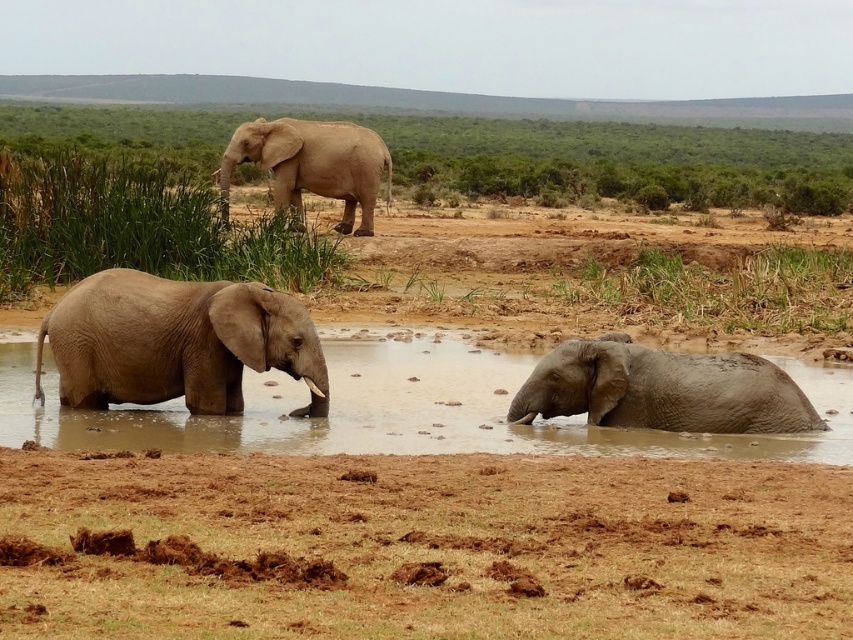
You are standing at the point marked by the coordinates [663,390] in the image. Looking around, you see a gray matte elephant at lower right. Which direction should you face to see the gray matte elephant at lower right?

The point marked by the coordinates [663,390] is the location of the gray matte elephant at lower right, so you are already facing it.

You are a wildlife photographer standing at the edge of the watering hole. You want to capture a close shot of the brown muddy water at center. If your camera has a maximum zoom range of 10 meters, can you get a clear close shot without moving closer?

The brown muddy water at center is 9.50 meters away from the viewer. Since the camera can zoom up to 10 meters, it is within range to capture a clear close shot without moving closer.

You are standing in the scene and want to place a small camera at one of the two points to capture the elephants in the water. Which point, point (514, 531) or point (756, 360), would give a better view of the elephants in the water?

Point (514, 531) is closer to the viewer than point (756, 360), so placing the camera there would provide a better view of the elephants in the water since it is nearer to them.